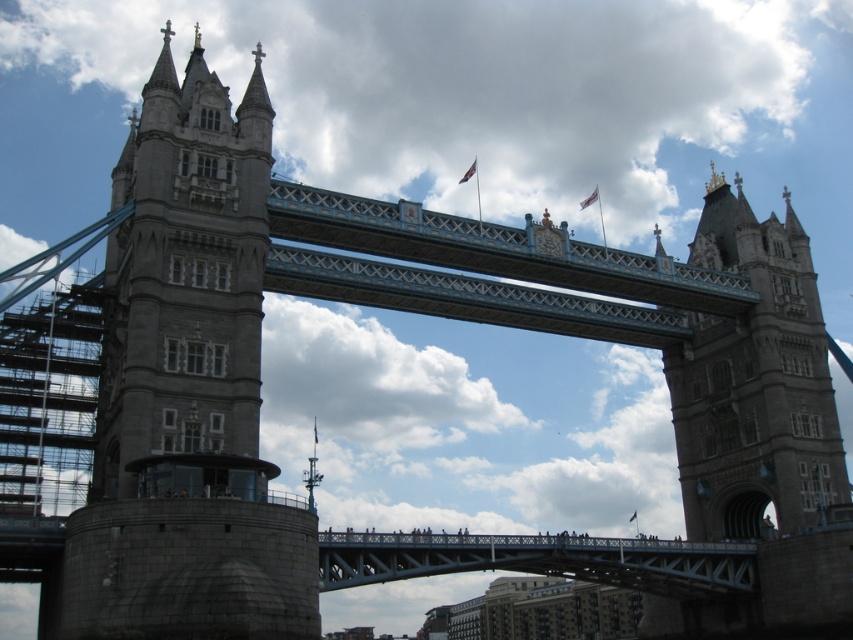
You are standing at the base of the gray stone tower bridge at left and want to take a photo of it. If your camera can focus on objects up to 200 feet away, will you be able to capture the bridge clearly?

The gray stone tower bridge at left is 182.72 feet away from the camera, which is within the 200 feet focusing range. Therefore, you can capture the bridge clearly.

You are an architect analyzing the proportions of Tower Bridge. Based on the image, which object occupies a larger portion of the frame between the white fluffy cloud at upper center and the stone gray tower at center?

The white fluffy cloud at upper center is bigger than the stone gray tower at center, so it occupies a larger portion of the frame.

You are standing on the south bank of the Thames River and looking north towards Tower Bridge. You notice the stone gray tower at center and the white fluffy cloud at center. According to the scene, which object is positioned higher in the sky?

The stone gray tower at center is located above the white fluffy cloud at center, so the stone gray tower at center is positioned higher in the sky.